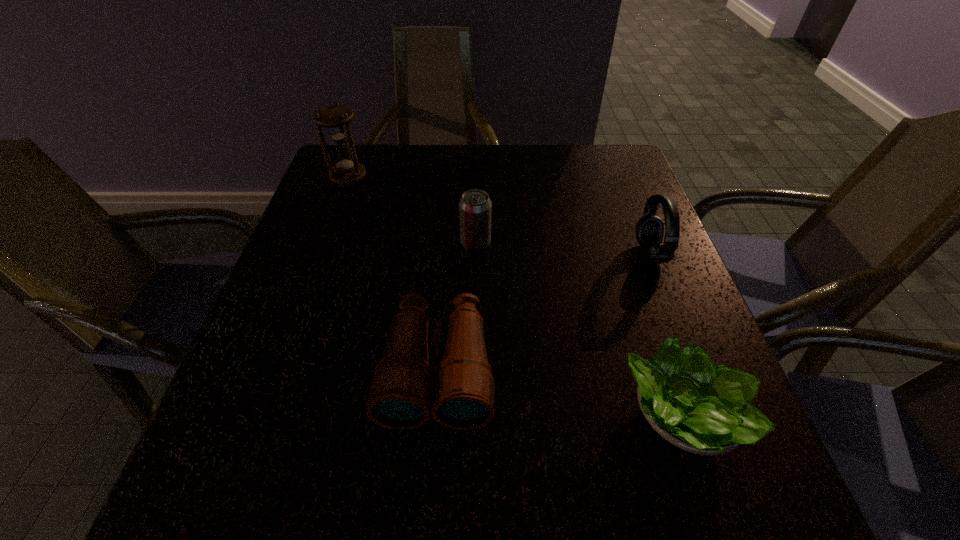
Find the location of a particular element. This screenshot has height=540, width=960. blank area at the far edge is located at coordinates (500, 184).

Locate an element on the screen. free location at the near edge is located at coordinates (360, 484).

I want to click on vacant space at the left edge, so click(292, 284).

This screenshot has height=540, width=960. Identify the location of free space at the right edge of the desktop. (695, 332).

In the image, there is a desktop. At what (x,y) coordinates should I click in order to perform the action: click on free space at the far left corner. Please return your answer as a coordinate pair (x, y). The image size is (960, 540). Looking at the image, I should click on (381, 151).

In the image, there is a desktop. Identify the location of free space at the near left corner. The height and width of the screenshot is (540, 960). (231, 464).

This screenshot has height=540, width=960. What are the coordinates of `vacant space in between the headset and the lettuce` in the screenshot? It's located at (665, 335).

Where is `free spot between the farthest object and the lettuce`? Image resolution: width=960 pixels, height=540 pixels. free spot between the farthest object and the lettuce is located at coordinates (516, 296).

Where is `empty space between the binoculars and the leftmost object`? empty space between the binoculars and the leftmost object is located at coordinates (393, 274).

Find the location of `empty location between the binoculars and the lettuce`. empty location between the binoculars and the lettuce is located at coordinates (560, 393).